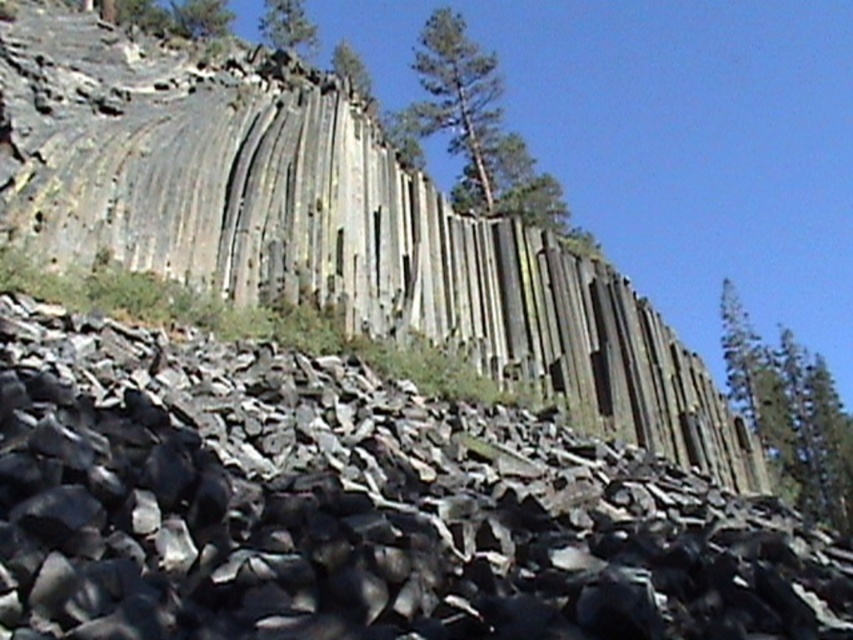
Based on the photo, you are standing at the base of the hexagonal basalt columns and want to take a photo of the green textured tree at upper center. According to the scene description, where should you position yourself to ensure the tree is centered in your camera viewfinder?

To center the green textured tree at upper center in your camera viewfinder, position yourself directly below the tree at the base of the hexagonal basalt columns. Since the tree is located at the upper center of the scene, aligning your camera upwards towards the coordinates point (477, 125) will center it in the viewfinder.

You are a geologist examining the scene. You need to determine which object is nearer to you. Based on the image, which is closer to you, the gray rock formation at upper center or the green textured tree at upper right?

The gray rock formation at upper center is closer to the viewer than the green textured tree at upper right.